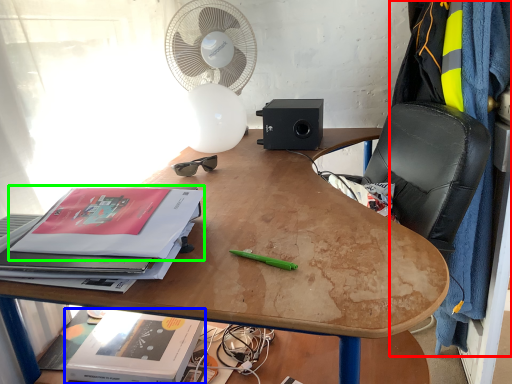
Question: Based on their relative distances, which object is farther from blanket (highlighted by a red box)? Choose from paperback book (highlighted by a blue box) and paperback book (highlighted by a green box).

Choices:
 (A) paperback book
 (B) paperback book

Answer: (A)